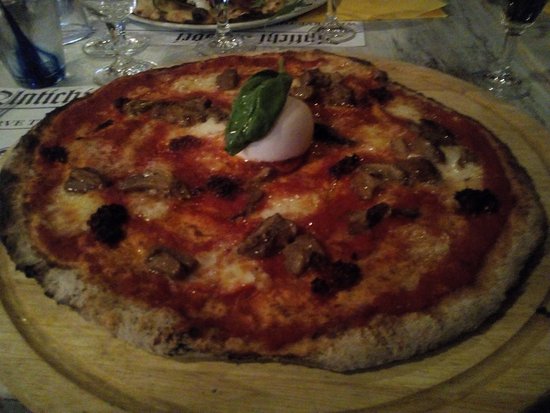
The image size is (550, 413). What are the coordinates of `wine glass` in the screenshot? It's located at (120, 2).